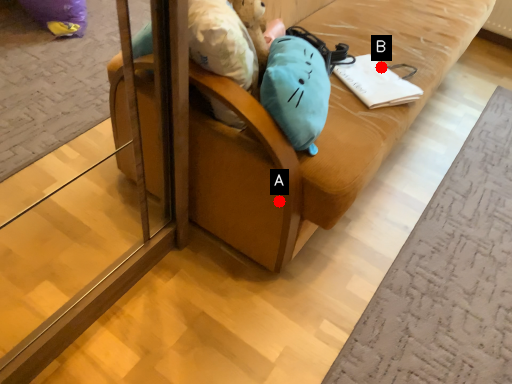
Question: Two points are circled on the image, labeled by A and B beside each circle. Which point is closer to the camera taking this photo?

Choices:
 (A) A is closer
 (B) B is closer

Answer: (A)